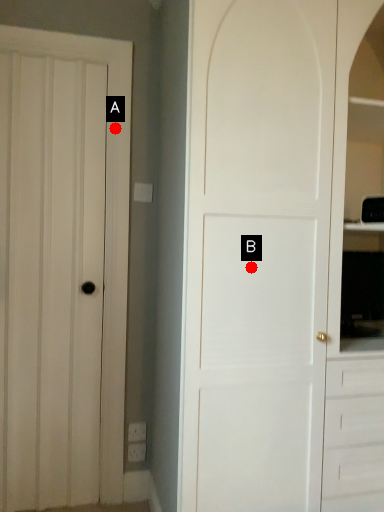
Question: Two points are circled on the image, labeled by A and B beside each circle. Which of the following is the farthest from the observer?

Choices:
 (A) A is further
 (B) B is further

Answer: (A)